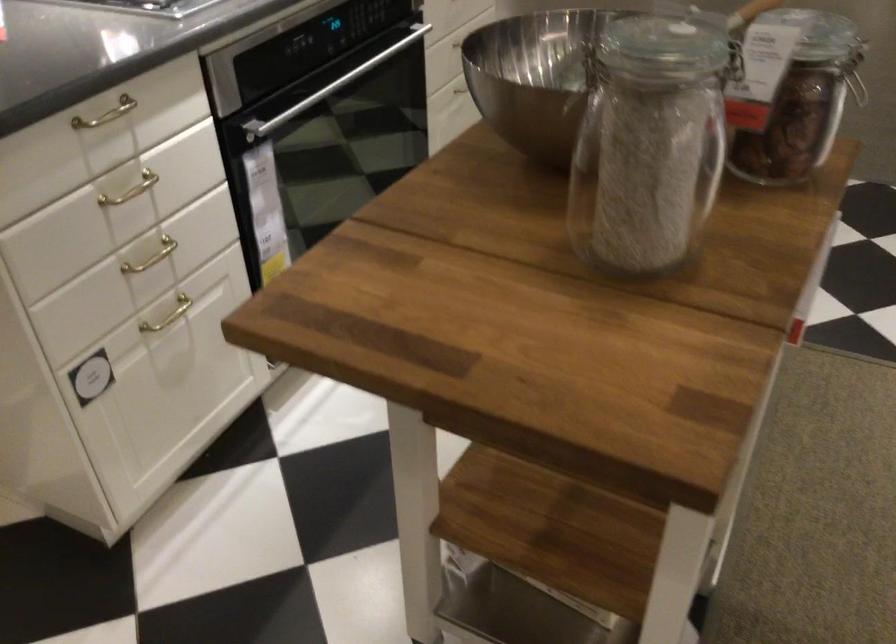
The height and width of the screenshot is (644, 896). What are the coordinates of `oven door handle` in the screenshot? It's located at [332, 86].